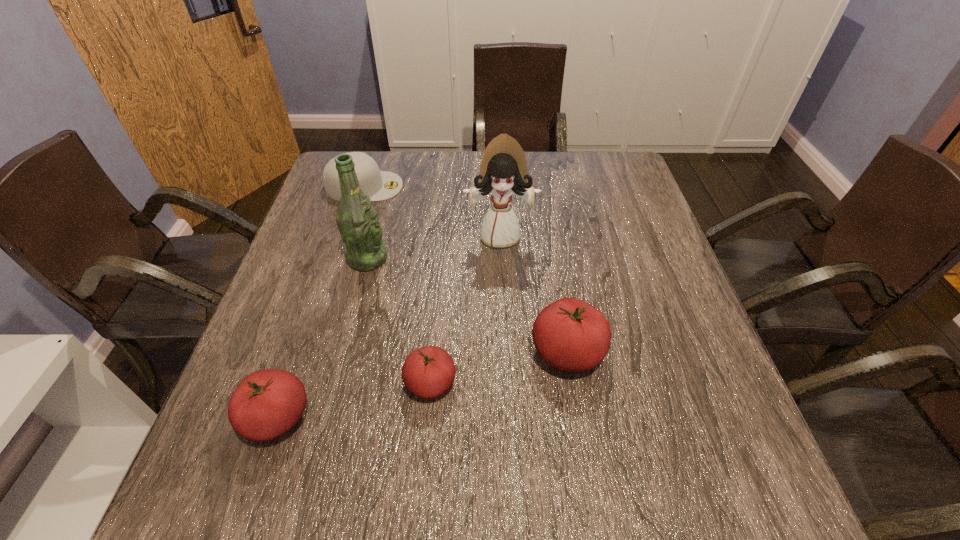
Identify the location of free location that satisfies the following two spatial constraints: 1. on the front-facing side of the second tomato from left to right; 2. on the right side of the cap. (302, 383).

You are a GUI agent. You are given a task and a screenshot of the screen. Output one action in this format:
    pyautogui.click(x=<x>, y=<y>)
    Task: Click on the vacant space that satisfies the following two spatial constraints: 1. at the front face of the doll; 2. on the surface of the beer bottle
    Image resolution: width=960 pixels, height=540 pixels.
    Given the screenshot: What is the action you would take?
    pyautogui.click(x=501, y=259)

This screenshot has width=960, height=540. Identify the location of vacant point that satisfies the following two spatial constraints: 1. on the surface of the beer bottle; 2. on the right side of the rightmost tomato. (344, 352).

Where is `free space that satisfies the following two spatial constraints: 1. on the front-facing side of the shortest tomato; 2. on the right side of the farthest object`? free space that satisfies the following two spatial constraints: 1. on the front-facing side of the shortest tomato; 2. on the right side of the farthest object is located at coordinates (302, 383).

What are the coordinates of `free point that satisfies the following two spatial constraints: 1. on the back side of the third object from right to left; 2. on the surface of the beer bottle` in the screenshot? It's located at (442, 259).

Locate an element on the screen. This screenshot has height=540, width=960. vacant space that satisfies the following two spatial constraints: 1. on the surface of the beer bottle; 2. on the front side of the third shortest object is located at coordinates (327, 417).

Find the location of `free space that satisfies the following two spatial constraints: 1. on the surface of the beer bottle; 2. on the back side of the shortest tomato`. free space that satisfies the following two spatial constraints: 1. on the surface of the beer bottle; 2. on the back side of the shortest tomato is located at coordinates (336, 383).